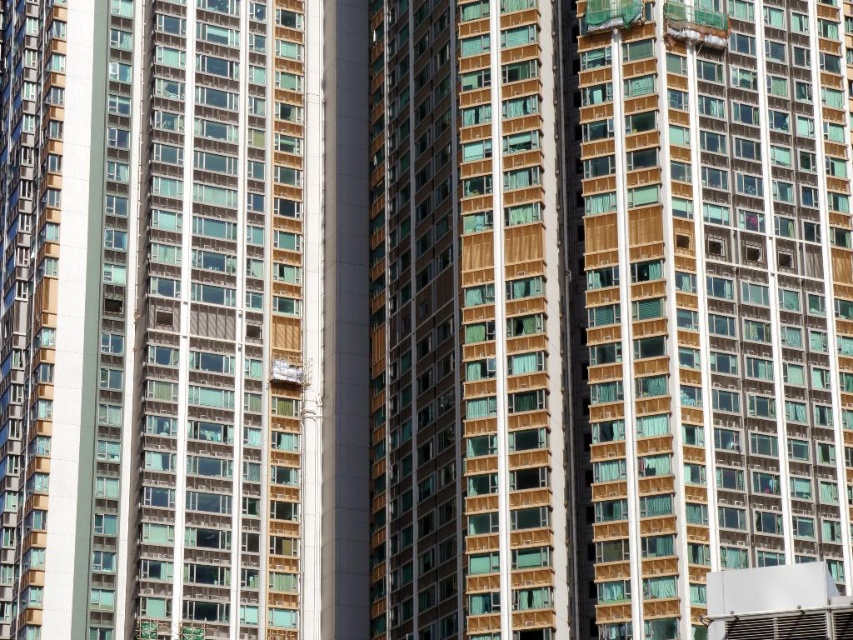
You are standing in front of two buildings in the city. You see the matte gold building at center and the matte brown building at center. Which one is positioned to the right side?

The matte gold building at center is positioned to the right of the matte brown building at center.

Looking at this image, you are an urban planner reviewing this city layout. You notice the matte gold building at center and the matte brown building at center. Which building has a lower height?

The matte gold building at center is not as tall as the matte brown building at center, so the matte gold building at center has a lower height.

You are standing in front of the cluster of high rise residential buildings. There is a point at (604, 308) that marks the location of the matte gold building at center. If you want to find the matte gold building at center, where should you look relative to the point?

The matte gold building at center is exactly at the point marked by coordinates (604, 308), so you should look directly at that point to find it.